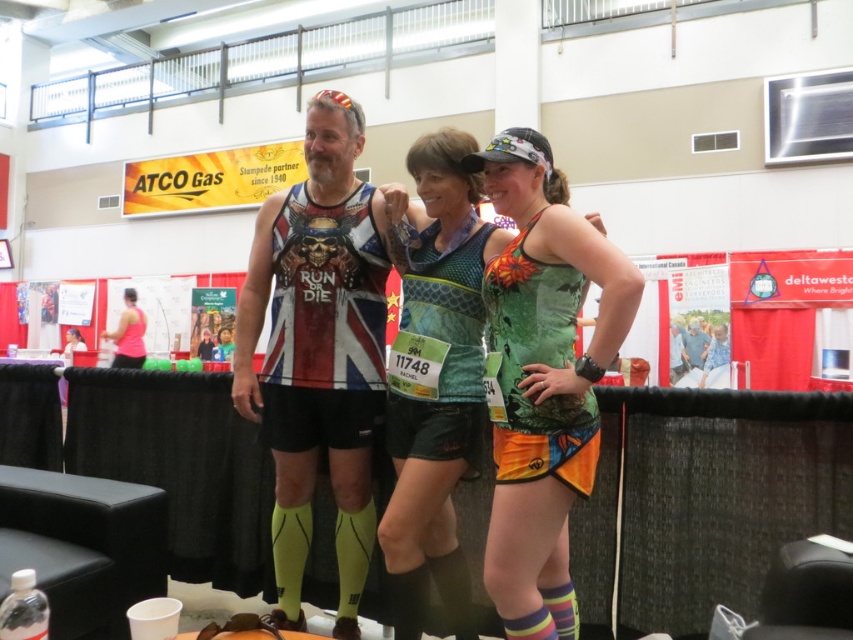
Question: Is matte jersey at center smaller than matte black tank top at center?

Choices:
 (A) no
 (B) yes

Answer: (A)

Question: Which of the following is the closest to the observer?

Choices:
 (A) matte black tank top at center
 (B) pink fabric tank top at left
 (C) green camouflage tank top at center

Answer: (C)

Question: Does matte jersey at center have a larger size compared to matte black tank top at center?

Choices:
 (A) yes
 (B) no

Answer: (A)

Question: Which object is the closest to the pink fabric tank top at left?

Choices:
 (A) matte black tank top at center
 (B) green camouflage tank top at center

Answer: (A)

Question: Does pink fabric tank top at left come in front of matte black tank top at center?

Choices:
 (A) yes
 (B) no

Answer: (B)

Question: Which of these objects is positioned farthest from the matte jersey at center?

Choices:
 (A) pink fabric tank top at left
 (B) green camouflage tank top at center
 (C) matte black tank top at center

Answer: (A)